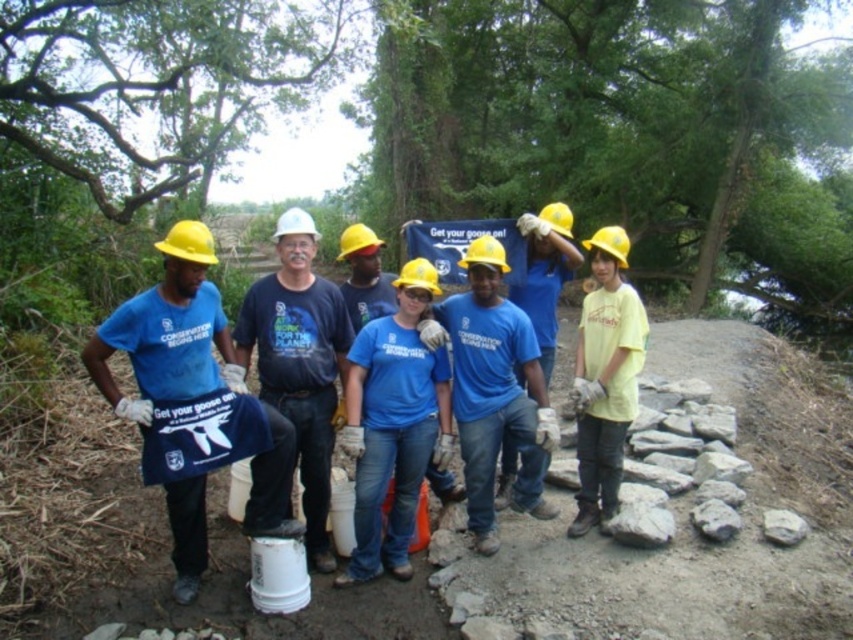
You are a safety inspector checking the distance between the matte blue shirt at center and the white hard hat at center. According to safety regulations, the minimum distance between a worker and their hard hat must be at least 20 inches for proper safety. Is the current distance compliant with the regulations?

The matte blue shirt at center and white hard hat at center are 18.60 inches apart, which is less than the required 20 inches. Therefore, the current distance does not comply with safety regulations.

You are a drone operator trying to capture a photo of the matte blue shirt at center. The drone is currently at point (195, 371). Is the drone positioned correctly to take the photo?

Yes, the drone is positioned correctly at point (195, 371) to take a photo of the matte blue shirt at center.

You are part of the community service group in the image. You need to hand a tool to the person wearing the matte blue shirt at center and the person with the white hard hat at center. Which person is closer to your left side?

The matte blue shirt at center is to the left of white hard hat at center, so the person wearing the matte blue shirt at center is closer to your left side.